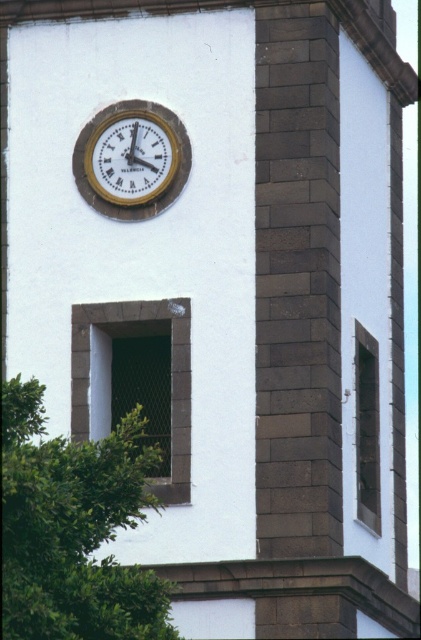
Question: Which of the following is the farthest from the observer?

Choices:
 (A) (125, 605)
 (B) (148, 209)

Answer: (B)

Question: Can you confirm if green leafy tree at lower left is positioned to the left of gold metallic clock at upper center?

Choices:
 (A) no
 (B) yes

Answer: (B)

Question: Does green leafy tree at lower left appear under gold metallic clock at upper center?

Choices:
 (A) yes
 (B) no

Answer: (A)

Question: Is the position of green leafy tree at lower left less distant than that of gold metallic clock at upper center?

Choices:
 (A) yes
 (B) no

Answer: (A)

Question: Which object is farther from the camera taking this photo?

Choices:
 (A) green leafy tree at lower left
 (B) gold metallic clock at upper center

Answer: (B)